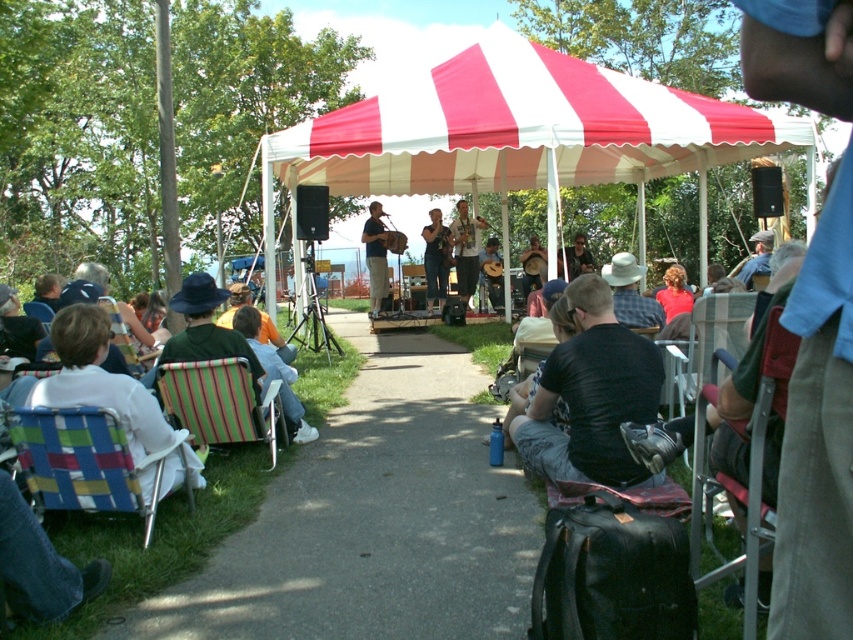
Is red and white striped canopy at upper center to the right of green striped folding chair at lower left from the viewer's perspective?

Correct, you'll find red and white striped canopy at upper center to the right of green striped folding chair at lower left.

The width and height of the screenshot is (853, 640). I want to click on red and white striped canopy at upper center, so (519, 129).

Can you confirm if multicolored woven fabric chair at lower left is bigger than metallic silver chair at center?

Incorrect, multicolored woven fabric chair at lower left is not larger than metallic silver chair at center.

Does multicolored woven fabric chair at lower left appear on the right side of metallic silver chair at center?

In fact, multicolored woven fabric chair at lower left is to the left of metallic silver chair at center.

Is point (115, 438) in front of point (740, 301)?

That is True.

Image resolution: width=853 pixels, height=640 pixels. Identify the location of multicolored woven fabric chair at lower left. (86, 461).

Between black cotton shirt at center and blue denim jacket at center, which one is positioned higher?

blue denim jacket at center

Is point (556, 356) positioned before point (755, 273)?

Yes.

What do you see at coordinates (590, 396) in the screenshot? The width and height of the screenshot is (853, 640). I see `black cotton shirt at center` at bounding box center [590, 396].

Image resolution: width=853 pixels, height=640 pixels. In order to click on black cotton shirt at center in this screenshot , I will do `click(590, 396)`.